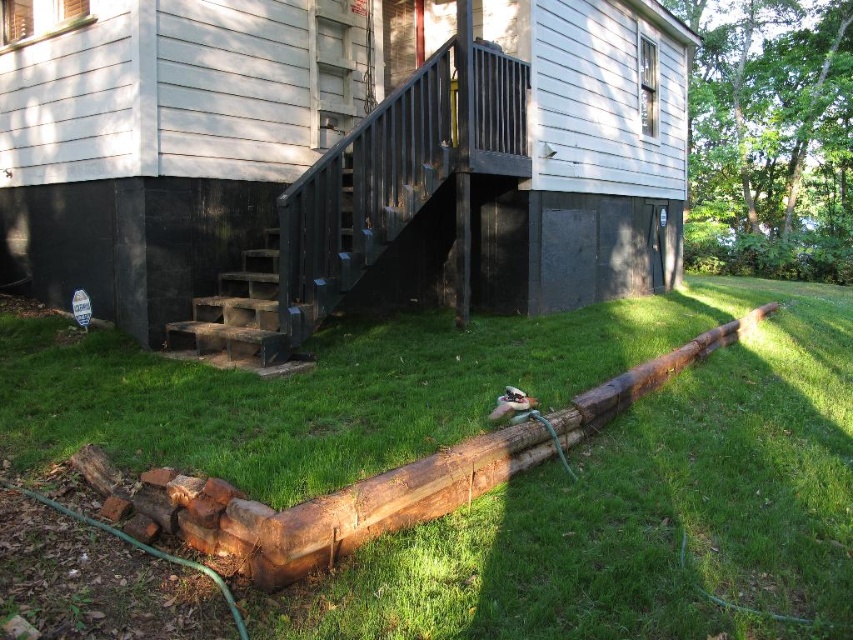
Question: Can you confirm if green grass at lower left is smaller than dark gray concrete stairs at lower left?

Choices:
 (A) yes
 (B) no

Answer: (B)

Question: Can you confirm if green grass at lower left is smaller than dark gray concrete stairs at lower left?

Choices:
 (A) yes
 (B) no

Answer: (B)

Question: Is green grass at lower left below dark gray concrete stairs at lower left?

Choices:
 (A) no
 (B) yes

Answer: (B)

Question: Among these objects, which one is nearest to the camera?

Choices:
 (A) green grass at lower left
 (B) dark gray concrete stairs at lower left

Answer: (A)

Question: Which point is farther to the camera?

Choices:
 (A) green grass at lower left
 (B) dark gray concrete stairs at lower left

Answer: (B)